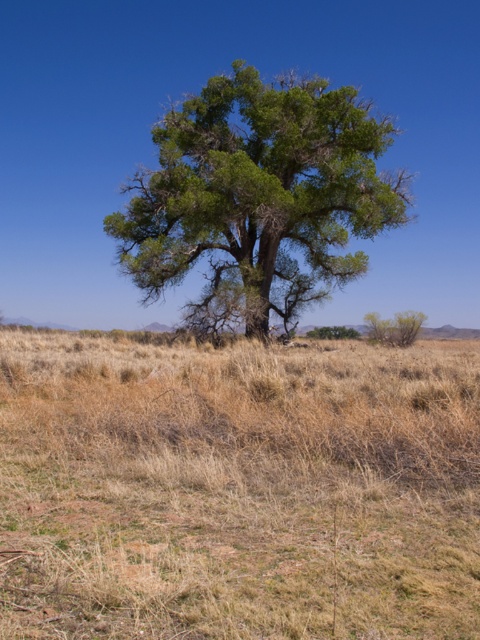
Describe the element at coordinates (238, 490) in the screenshot. I see `dry grass at center` at that location.

Is dry grass at center smaller than green leafy tree at center?

Yes, dry grass at center is smaller than green leafy tree at center.

Describe the element at coordinates (238, 490) in the screenshot. I see `dry grass at center` at that location.

This screenshot has height=640, width=480. Find the location of `dry grass at center`. dry grass at center is located at coordinates (238, 490).